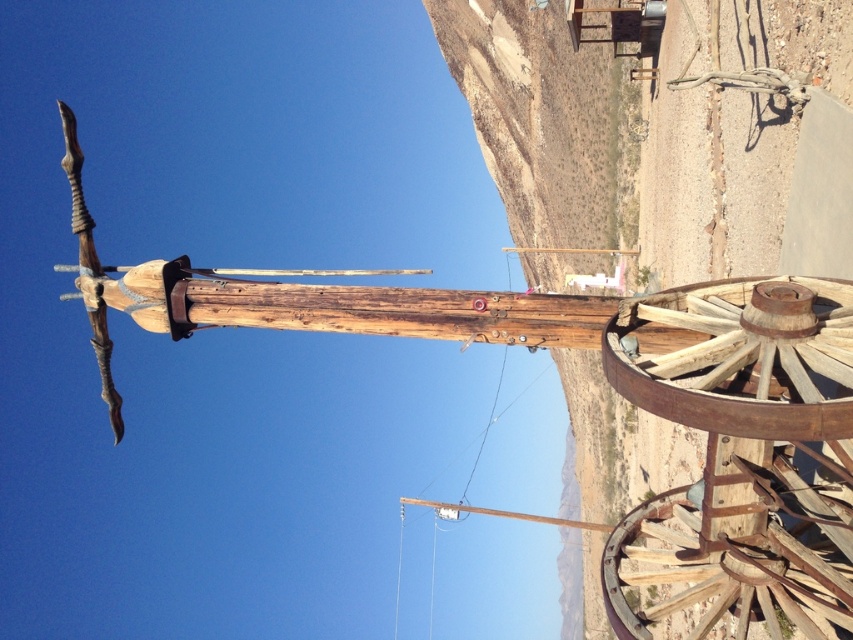
You are an engineer assessing the structural integrity of the rusty wood wagon wheel at lower right and the rusty wood wagon wheel at right. Which wheel has a larger diameter?

The rusty wood wagon wheel at lower right has a larger diameter than the rusty wood wagon wheel at right because its width surpasses the other.